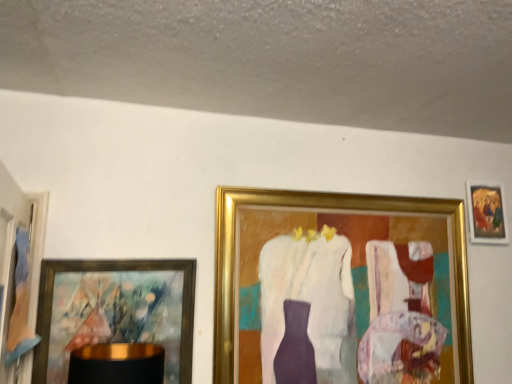
Question: Considering the relative sizes of gold metallic picture frame at center, marked as the third picture frame in a left-to-right arrangement, and gold-framed painting at upper right, placed as the first picture frame when sorted from right to left, in the image provided, is gold metallic picture frame at center, marked as the third picture frame in a left-to-right arrangement, wider than gold-framed painting at upper right, placed as the first picture frame when sorted from right to left,?

Choices:
 (A) yes
 (B) no

Answer: (A)

Question: Considering the relative sizes of gold metallic picture frame at center, the second picture frame viewed from the right, and gold-framed painting at upper right, which appears as the 4th picture frame when viewed from the left, in the image provided, is gold metallic picture frame at center, the second picture frame viewed from the right, thinner than gold-framed painting at upper right, which appears as the 4th picture frame when viewed from the left,?

Choices:
 (A) yes
 (B) no

Answer: (B)

Question: From a real-world perspective, does gold metallic picture frame at center, the second picture frame viewed from the right, stand above gold-framed painting at upper right, which appears as the 4th picture frame when viewed from the left?

Choices:
 (A) no
 (B) yes

Answer: (A)

Question: Considering the relative positions of gold metallic picture frame at center, marked as the third picture frame in a left-to-right arrangement, and gold-framed painting at upper right, which appears as the 4th picture frame when viewed from the left, in the image provided, is gold metallic picture frame at center, marked as the third picture frame in a left-to-right arrangement, to the left of gold-framed painting at upper right, which appears as the 4th picture frame when viewed from the left, from the viewer's perspective?

Choices:
 (A) no
 (B) yes

Answer: (B)

Question: Is gold metallic picture frame at center, marked as the third picture frame in a left-to-right arrangement, shorter than gold-framed painting at upper right, placed as the first picture frame when sorted from right to left?

Choices:
 (A) no
 (B) yes

Answer: (A)

Question: Is gold metallic picture frame at center, the second picture frame viewed from the right, bigger than gold-framed painting at upper right, which appears as the 4th picture frame when viewed from the left?

Choices:
 (A) no
 (B) yes

Answer: (B)

Question: Does wooden picture frame at left, which is the 4th picture frame in right-to-left order, appear on the left side of gold-framed painting at left, positioned as the second picture frame in left-to-right order?

Choices:
 (A) no
 (B) yes

Answer: (B)

Question: Is wooden picture frame at left, positioned as the first picture frame in left-to-right order, placed right next to gold-framed painting at left, which ranks as the third picture frame in right-to-left order?

Choices:
 (A) no
 (B) yes

Answer: (A)

Question: Is wooden picture frame at left, which is the 4th picture frame in right-to-left order, further to camera compared to gold-framed painting at left, which ranks as the third picture frame in right-to-left order?

Choices:
 (A) yes
 (B) no

Answer: (B)

Question: Is wooden picture frame at left, which is the 4th picture frame in right-to-left order, wider than gold-framed painting at left, positioned as the second picture frame in left-to-right order?

Choices:
 (A) no
 (B) yes

Answer: (B)

Question: Is wooden picture frame at left, positioned as the first picture frame in left-to-right order, thinner than gold-framed painting at left, positioned as the second picture frame in left-to-right order?

Choices:
 (A) yes
 (B) no

Answer: (B)

Question: Is wooden picture frame at left, which is the 4th picture frame in right-to-left order, taller than gold-framed painting at left, positioned as the second picture frame in left-to-right order?

Choices:
 (A) yes
 (B) no

Answer: (A)

Question: From the image's perspective, is gold-framed painting at upper right, placed as the first picture frame when sorted from right to left, on gold-framed painting at left, which ranks as the third picture frame in right-to-left order?

Choices:
 (A) yes
 (B) no

Answer: (A)